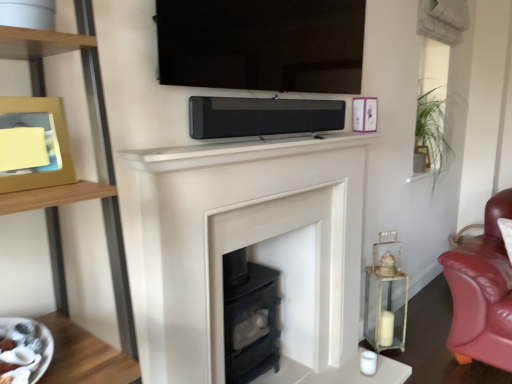
Question: Would you say white glossy plate at lower left is inside or outside wooden picture frame at left, which is the first picture frame from left to right?

Choices:
 (A) outside
 (B) inside

Answer: (A)

Question: Considering the positions of white glossy plate at lower left and wooden picture frame at left, the 1th picture frame from the front, in the image, is white glossy plate at lower left taller or shorter than wooden picture frame at left, the 1th picture frame from the front,?

Choices:
 (A) short
 (B) tall

Answer: (A)

Question: Based on their relative distances, which object is farther from the white matte fireplace mantel at center?

Choices:
 (A) metallic purple picture frame at upper right, which is the 1th picture frame from top to bottom
 (B) white matte fireplace at center
 (C) black matte soundbar at center
 (D) white glossy plate at lower left
 (E) green leafy plant at upper right

Answer: (E)

Question: Considering the real-world distances, which object is farthest from the wooden picture frame at left, which appears as the second picture frame when viewed from the back?

Choices:
 (A) white glossy plate at lower left
 (B) metallic purple picture frame at upper right, the 2th picture frame from the left
 (C) black matte soundbar at center
 (D) white matte fireplace mantel at center
 (E) white matte fireplace at center

Answer: (B)